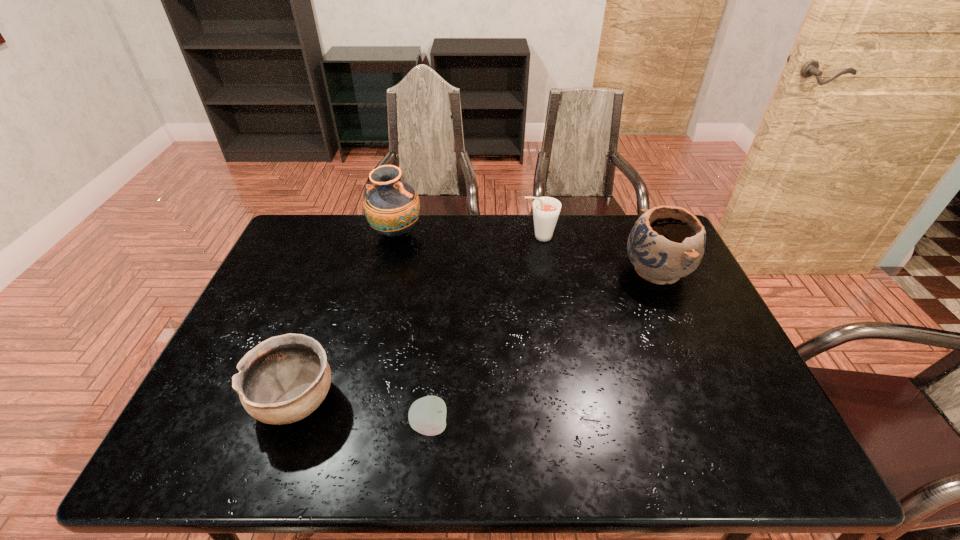
At what (x,y) coordinates should I click in order to perform the action: click on object present at the right edge. Please return your answer as a coordinate pair (x, y). Looking at the image, I should click on (666, 243).

Find the location of `object located in the near left corner section of the desktop`. object located in the near left corner section of the desktop is located at coordinates (282, 380).

Where is `object that is at the far right corner`? Image resolution: width=960 pixels, height=540 pixels. object that is at the far right corner is located at coordinates (666, 243).

Image resolution: width=960 pixels, height=540 pixels. In the image, there is a desktop. What are the coordinates of `free space at the far edge` in the screenshot? It's located at (373, 256).

I want to click on vacant space at the near edge of the desktop, so click(x=661, y=449).

Identify the location of vacant space at the far left corner of the desktop. The height and width of the screenshot is (540, 960). (329, 248).

At what (x,y) coordinates should I click in order to perform the action: click on free space between the root beer and the shortest pottery. Please return your answer as a coordinate pair (x, y). Looking at the image, I should click on (418, 319).

At what (x,y) coordinates should I click in order to perform the action: click on vacant area that lies between the rightmost object and the second object from right to left. Please return your answer as a coordinate pair (x, y). This screenshot has width=960, height=540. Looking at the image, I should click on (598, 254).

The width and height of the screenshot is (960, 540). Identify the location of blank region between the third object from right to left and the nearest pottery. (363, 413).

This screenshot has height=540, width=960. Identify the location of blank region between the rightmost pottery and the apple. (542, 348).